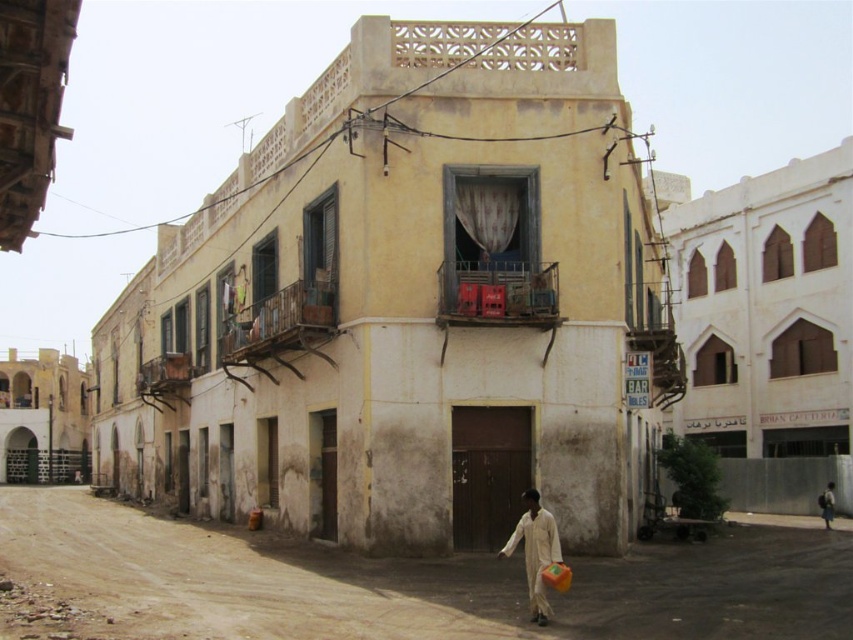
Question: Which point is closer to the camera?

Choices:
 (A) dull concrete alley at lower left
 (B) light brown fabric bag at lower right
 (C) white cotton person at lower right

Answer: (A)

Question: Does dull concrete alley at lower left have a larger size compared to light brown fabric bag at lower right?

Choices:
 (A) no
 (B) yes

Answer: (B)

Question: Can you confirm if white cotton person at lower right is positioned to the left of light brown fabric bag at lower right?

Choices:
 (A) no
 (B) yes

Answer: (B)

Question: Which point is closer to the camera?

Choices:
 (A) dull concrete alley at lower left
 (B) white cotton person at lower right
 (C) light brown fabric bag at lower right

Answer: (A)

Question: Can you confirm if dull concrete alley at lower left is positioned to the right of light brown fabric bag at lower right?

Choices:
 (A) no
 (B) yes

Answer: (A)

Question: Considering the real-world distances, which object is farthest from the dull concrete alley at lower left?

Choices:
 (A) light brown fabric bag at lower right
 (B) white cotton person at lower right

Answer: (A)